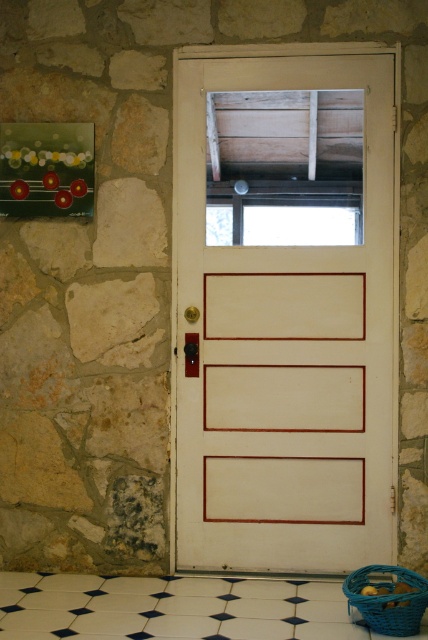
Question: Where is white painted wood door at center located in relation to blue woven basket at lower right in the image?

Choices:
 (A) left
 (B) right

Answer: (A)

Question: Is white painted wood door at center to the left of blue woven basket at lower right from the viewer's perspective?

Choices:
 (A) no
 (B) yes

Answer: (B)

Question: Which of the following is the closest to the observer?

Choices:
 (A) blue woven basket at lower right
 (B) white glossy tile at lower center
 (C) white painted wood door at center

Answer: (B)

Question: Which point is closer to the camera taking this photo?

Choices:
 (A) (338, 342)
 (B) (410, 618)
 (C) (311, 627)

Answer: (B)

Question: Where is white painted wood door at center located in relation to white glossy tile at lower center in the image?

Choices:
 (A) left
 (B) right

Answer: (B)

Question: Which of the following is the closest to the observer?

Choices:
 (A) (359, 588)
 (B) (219, 278)

Answer: (A)